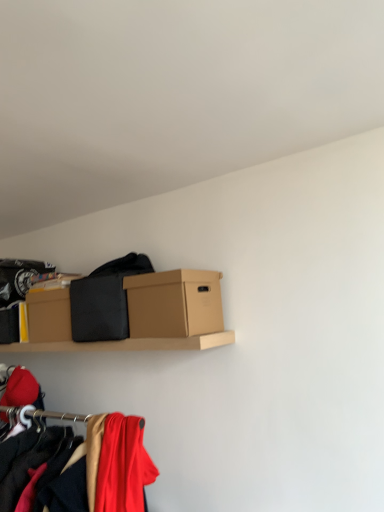
Question: Should I look upward or downward to see brown cardboard box at center?

Choices:
 (A) up
 (B) down

Answer: (B)

Question: From the image's perspective, is matte red fabric at lower left, the 2th clothing viewed from the top, on top of brown cardboard box at center?

Choices:
 (A) no
 (B) yes

Answer: (A)

Question: Is matte red fabric at lower left, marked as the 2th clothing in a back-to-front arrangement, closer to the viewer compared to brown cardboard box at center?

Choices:
 (A) no
 (B) yes

Answer: (B)

Question: Does matte red fabric at lower left, marked as the first clothing in a bottom-to-top arrangement, have a greater height compared to brown cardboard box at center?

Choices:
 (A) no
 (B) yes

Answer: (B)

Question: Is matte red fabric at lower left, marked as the 2th clothing in a back-to-front arrangement, completely or partially outside of brown cardboard box at center?

Choices:
 (A) no
 (B) yes

Answer: (B)

Question: Would you consider matte red fabric at lower left, the 2th clothing viewed from the top, to be distant from brown cardboard box at center?

Choices:
 (A) no
 (B) yes

Answer: (A)

Question: Is matte red fabric at lower left, marked as the 2th clothing in a back-to-front arrangement, to the left of brown cardboard box at center from the viewer's perspective?

Choices:
 (A) yes
 (B) no

Answer: (A)

Question: Is black matte fabric at center, the 2th clothing from the front, oriented away from brown cardboard box at center?

Choices:
 (A) yes
 (B) no

Answer: (B)

Question: Is black matte fabric at center, the 1th clothing when ordered from back to front, at the left side of brown cardboard box at center?

Choices:
 (A) yes
 (B) no

Answer: (A)

Question: Could you tell me if black matte fabric at center, the second clothing in the bottom-to-top sequence, is turned towards brown cardboard box at center?

Choices:
 (A) yes
 (B) no

Answer: (B)

Question: Does black matte fabric at center, the 1th clothing when ordered from back to front, have a lesser width compared to brown cardboard box at center?

Choices:
 (A) no
 (B) yes

Answer: (A)

Question: Considering the relative sizes of black matte fabric at center, the 2th clothing from the front, and brown cardboard box at center in the image provided, is black matte fabric at center, the 2th clothing from the front, shorter than brown cardboard box at center?

Choices:
 (A) no
 (B) yes

Answer: (A)

Question: Is black matte fabric at center, the 1th clothing when ordered from back to front, not close to brown cardboard box at center?

Choices:
 (A) no
 (B) yes

Answer: (A)

Question: Considering the relative sizes of brown cardboard box at center and black matte fabric at center, the second clothing in the bottom-to-top sequence, in the image provided, is brown cardboard box at center thinner than black matte fabric at center, the second clothing in the bottom-to-top sequence,?

Choices:
 (A) no
 (B) yes

Answer: (B)